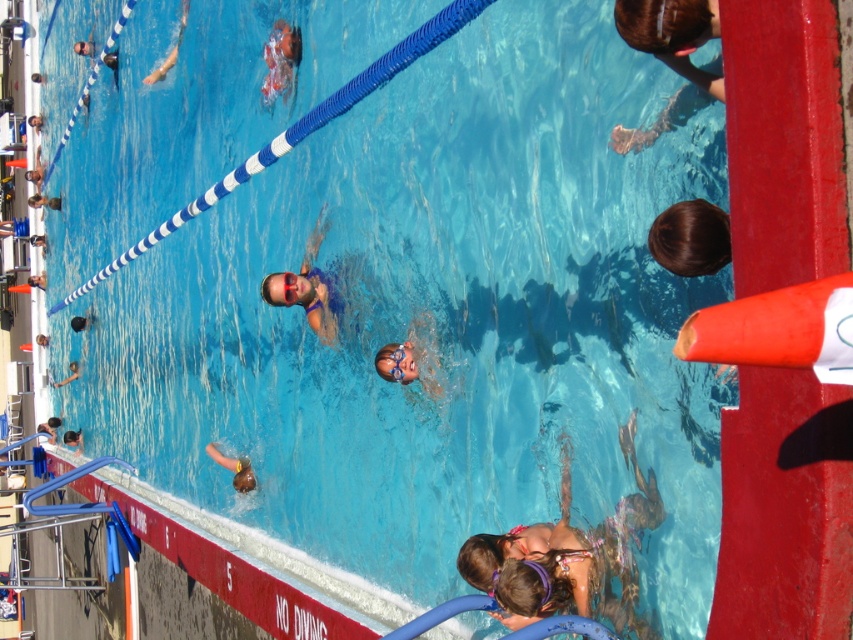
Does point (682, 3) come behind point (283, 54)?

No, it is not.

Image resolution: width=853 pixels, height=640 pixels. What are the coordinates of `brown hair at upper right` in the screenshot? It's located at (672, 35).

Can you confirm if matte yellow swim cap at lower center is positioned below smooth skin face at lower left?

Actually, matte yellow swim cap at lower center is above smooth skin face at lower left.

Does matte yellow swim cap at lower center have a lesser height compared to smooth skin face at lower left?

Indeed, matte yellow swim cap at lower center has a lesser height compared to smooth skin face at lower left.

Where is `matte yellow swim cap at lower center`? matte yellow swim cap at lower center is located at coordinates (234, 468).

Is point (492, 582) positioned after point (654, 221)?

Yes, point (492, 582) is farther from viewer.

Describe the element at coordinates (567, 556) in the screenshot. The height and width of the screenshot is (640, 853). I see `light pink fabric bikini at lower center` at that location.

The width and height of the screenshot is (853, 640). Identify the location of light pink fabric bikini at lower center. (567, 556).